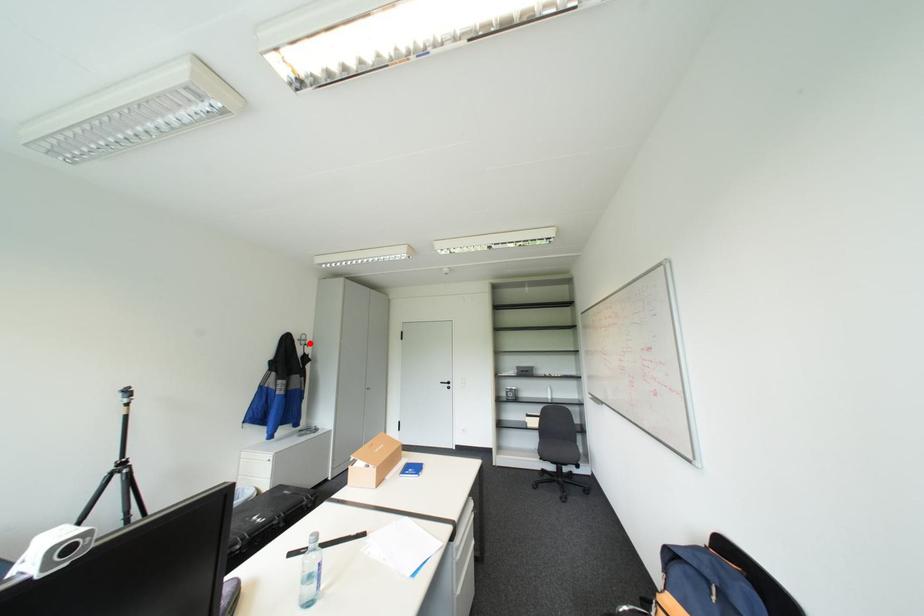
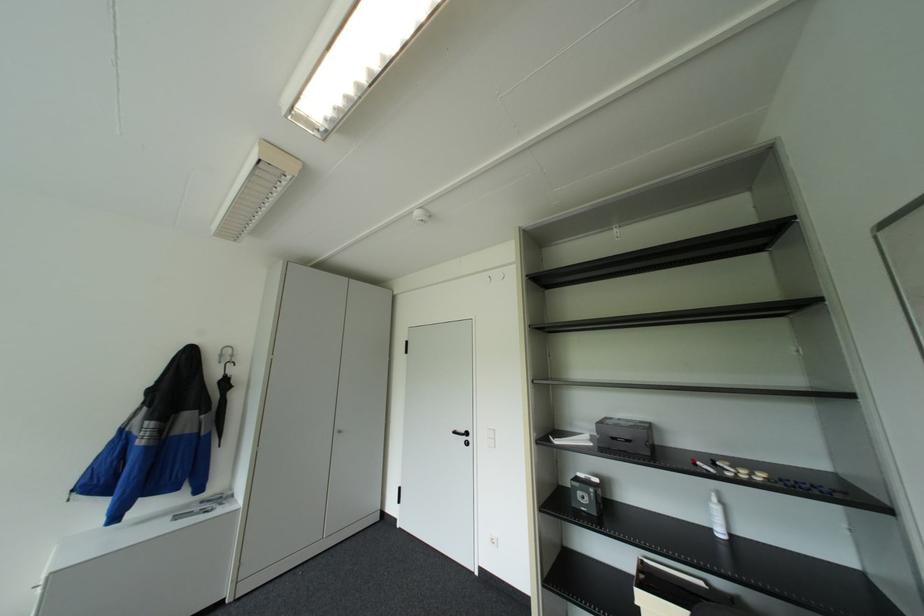
The point at the highlighted location is marked in the first image. Where is the corresponding point in the second image?

(227, 361)